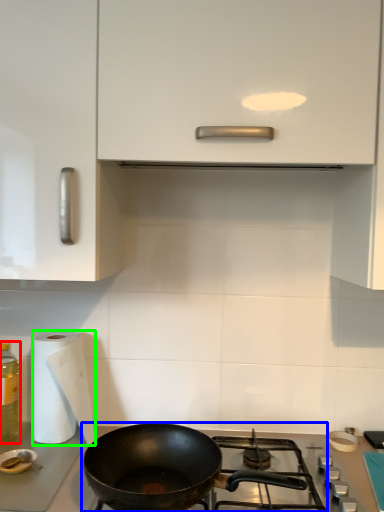
Question: Which is farther away from bottle (highlighted by a red box)? gas stove (highlighted by a blue box) or paper towel (highlighted by a green box)?

Choices:
 (A) gas stove
 (B) paper towel

Answer: (A)